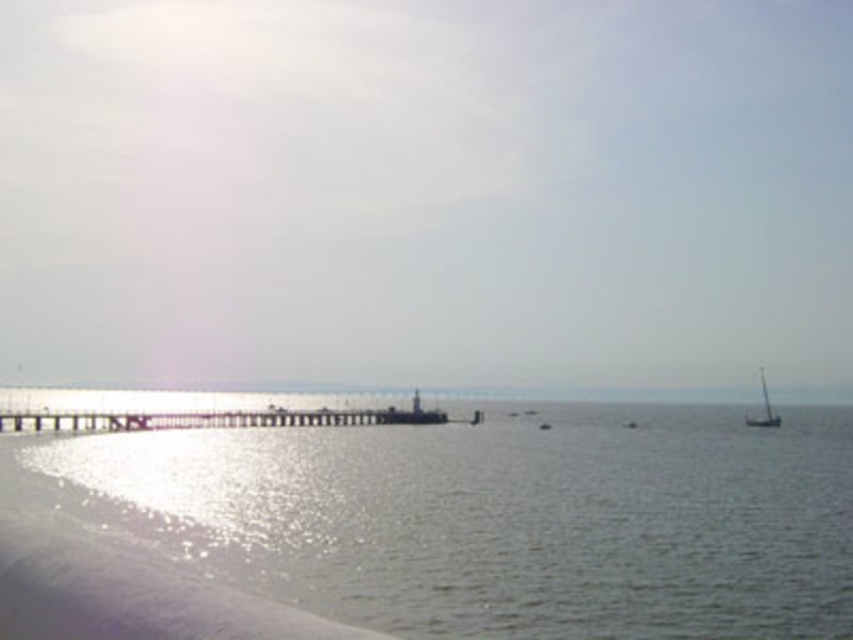
Locate an element on the screen. smooth glass water at center is located at coordinates (201, 392).

Is smooth glass water at center to the right of wooden pier at center from the viewer's perspective?

Indeed, smooth glass water at center is positioned on the right side of wooden pier at center.

The height and width of the screenshot is (640, 853). In order to click on smooth glass water at center in this screenshot , I will do `click(201, 392)`.

Image resolution: width=853 pixels, height=640 pixels. Identify the location of smooth glass water at center. (201, 392).

Between wooden pier at center and white matte sailboat at right, which one is positioned higher?

wooden pier at center is higher up.

Does wooden pier at center come behind white matte sailboat at right?

No, wooden pier at center is in front of white matte sailboat at right.

Find the location of a particular element. The width and height of the screenshot is (853, 640). wooden pier at center is located at coordinates (213, 419).

Is the position of shiny silver water at lower left more distant than that of wooden pier at center?

That is False.

Measure the distance between point (154, 452) and camera.

Point (154, 452) and camera are 233.16 feet apart from each other.

You are a GUI agent. You are given a task and a screenshot of the screen. Output one action in this format:
    pyautogui.click(x=<x>, y=<y>)
    Task: Click on the shiny silver water at lower left
    The height and width of the screenshot is (640, 853).
    Given the screenshot: What is the action you would take?
    pyautogui.click(x=497, y=518)